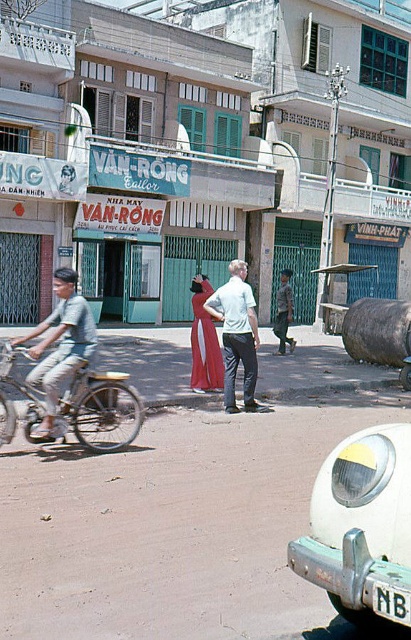
Question: Does white matte scooter at lower right appear on the right side of light brown fabric shirt at center?

Choices:
 (A) yes
 (B) no

Answer: (B)

Question: Is white matte scooter at lower right further to the viewer compared to matte gray bicycle at left?

Choices:
 (A) no
 (B) yes

Answer: (A)

Question: Considering the relative positions of matte gray bicycle at left and matte red dress at center in the image provided, where is matte gray bicycle at left located with respect to matte red dress at center?

Choices:
 (A) above
 (B) below

Answer: (B)

Question: Estimate the real-world distances between objects in this image. Which object is farther from the white matte scooter at lower right?

Choices:
 (A) matte gray pants at center
 (B) matte gray bicycle at left

Answer: (A)

Question: Estimate the real-world distances between objects in this image. Which object is closer to the matte gray bicycle at left?

Choices:
 (A) white matte scooter at lower right
 (B) matte red dress at center

Answer: (B)

Question: Which object is the closest to the matte gray pants at center?

Choices:
 (A) white matte scooter at lower right
 (B) matte gray bicycle at left
 (C) silver metallic bicycle at left
 (D) light brown fabric shirt at center

Answer: (C)